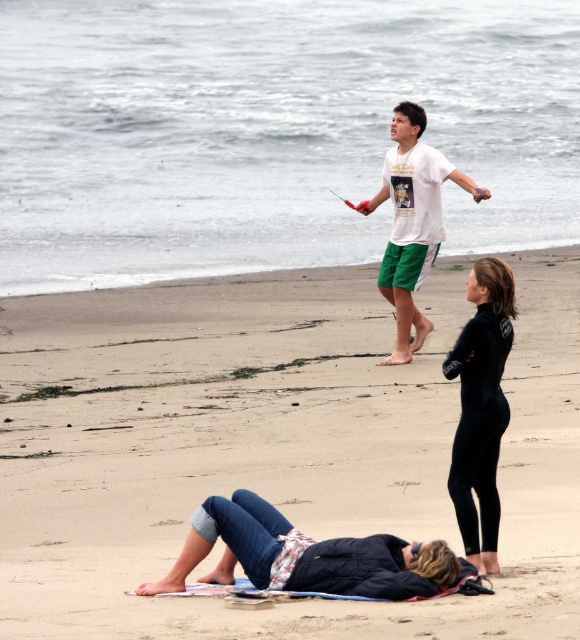
Is point (165, 371) in front of point (143, 582)?

No, it is not.

The width and height of the screenshot is (580, 640). What are the coordinates of `smooth tan sand at center` in the screenshot? It's located at (276, 445).

What are the coordinates of `smooth tan sand at center` in the screenshot? It's located at (276, 445).

Does black wetsuit at lower right appear under white t-shirt at upper center?

Indeed, black wetsuit at lower right is positioned under white t-shirt at upper center.

Which is in front, point (484, 332) or point (473, 184)?

Point (484, 332) is more forward.

The height and width of the screenshot is (640, 580). Describe the element at coordinates (480, 406) in the screenshot. I see `black wetsuit at lower right` at that location.

Find the location of a particular element. The height and width of the screenshot is (640, 580). black wetsuit at lower right is located at coordinates (480, 406).

Can you confirm if smooth tan sand at center is thinner than white t-shirt at upper center?

No.

Does smooth tan sand at center appear over white t-shirt at upper center?

No.

Where is `smooth tan sand at center`? This screenshot has height=640, width=580. smooth tan sand at center is located at coordinates (276, 445).